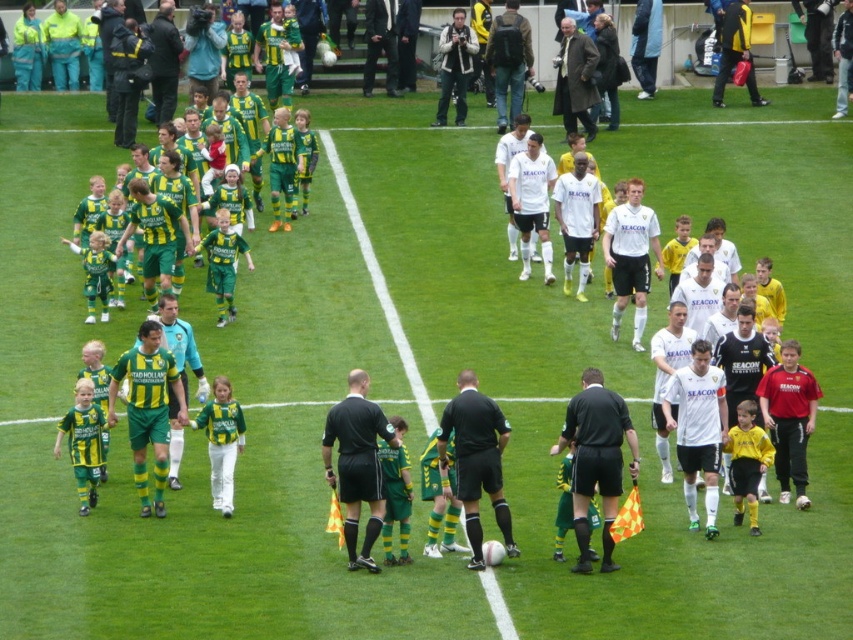
Can you confirm if green jersey at center is positioned to the right of white matte jersey at center?

In fact, green jersey at center is to the left of white matte jersey at center.

Who is positioned more to the left, green jersey at center or white matte jersey at center?

From the viewer's perspective, green jersey at center appears more on the left side.

Which is in front, point (387, 145) or point (521, 150)?

Point (521, 150) is more forward.

The image size is (853, 640). In order to click on green jersey at center in this screenshot , I will do `click(469, 259)`.

Who is taller, green jersey at center or dark gray coat at center?

green jersey at center is taller.

Does green jersey at center lie behind dark gray coat at center?

No, green jersey at center is in front of dark gray coat at center.

Does point (515, 413) come behind point (592, 44)?

No, (515, 413) is in front of (592, 44).

Identify the location of green jersey at center. Image resolution: width=853 pixels, height=640 pixels. (469, 259).

Can you confirm if dark blue jeans at center is positioned below yellow jacket at center?

Yes.

Does dark blue jeans at center appear on the right side of yellow jacket at center?

No, dark blue jeans at center is not to the right of yellow jacket at center.

Which is behind, point (519, 58) or point (721, 40)?

Positioned behind is point (721, 40).

The height and width of the screenshot is (640, 853). I want to click on dark blue jeans at center, so click(x=509, y=60).